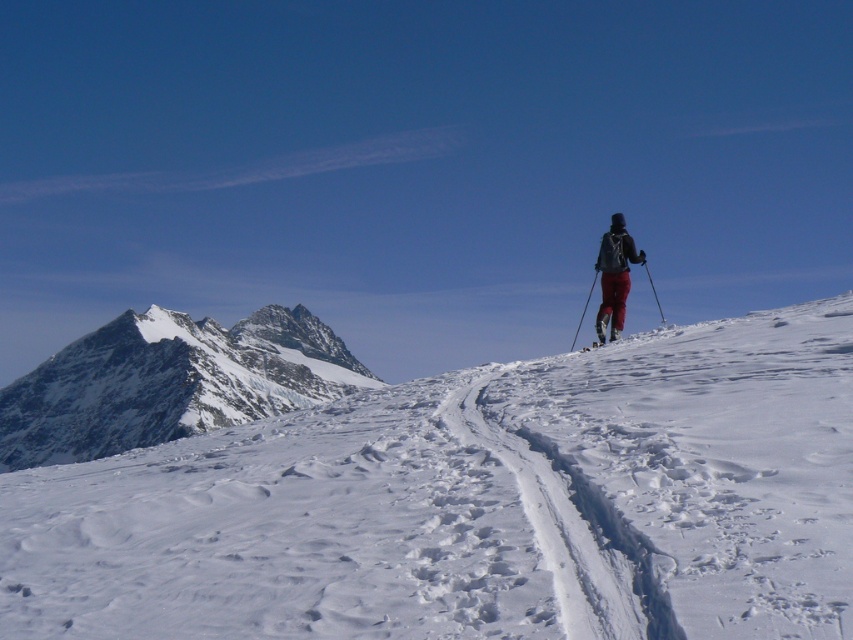
Based on the coordinates provided, what is located at point [477,504] in the winter scene?

The point [477,504] indicates white powdery snow at center.

You are a hiker who wants to locate the red fabric pants at right in the winter scene. Based on the coordinates provided, where exactly would you look on the image?

The red fabric pants at right are located at the coordinates point (614,275) on the image.